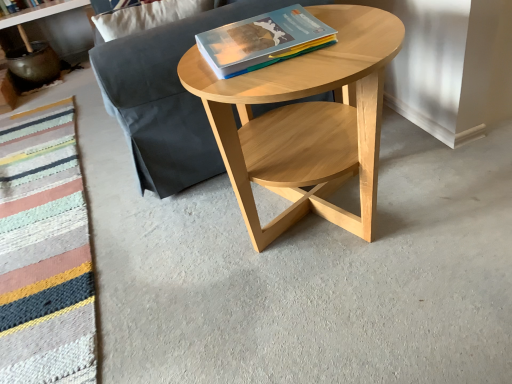
You are a GUI agent. You are given a task and a screenshot of the screen. Output one action in this format:
    pyautogui.click(x=<x>, y=<y>)
    Task: Click on the empty space that is to the right of natural wood coffee table at center
    
    Given the screenshot: What is the action you would take?
    pyautogui.click(x=439, y=188)